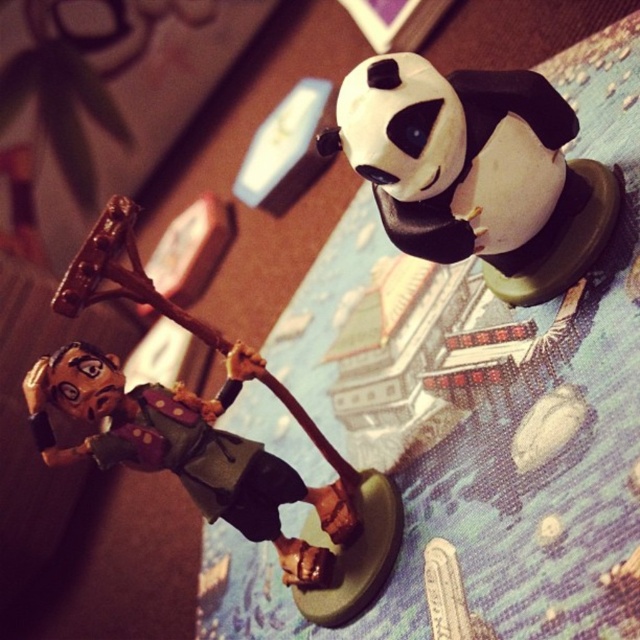
You are playing a tabletop game and have two points marked on the game board. The first point is at coordinates point (509, 244) and the second is at point (244, 372). Which point is closer to you as you look at the board?

Point (509, 244) is closer to the viewer than point (244, 372).

You are playing a tabletop game and have to place both the white matte panda at upper right and the matte brown wood figure at center on the game board. Which figurine requires more space due to its size?

The matte brown wood figure at center requires more space because it is larger than the white matte panda at upper right.